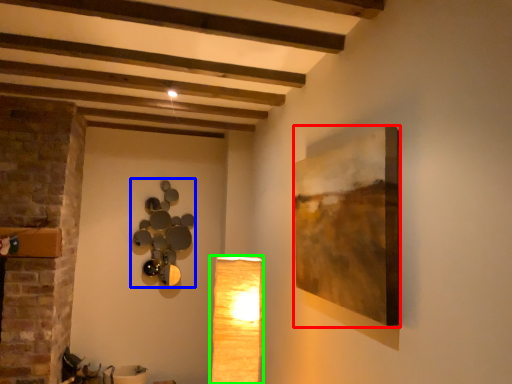
Question: Based on their relative distances, which object is farther from picture frame (highlighted by a red box)? Choose from lamp (highlighted by a blue box) and lamp (highlighted by a green box).

Choices:
 (A) lamp
 (B) lamp

Answer: (A)